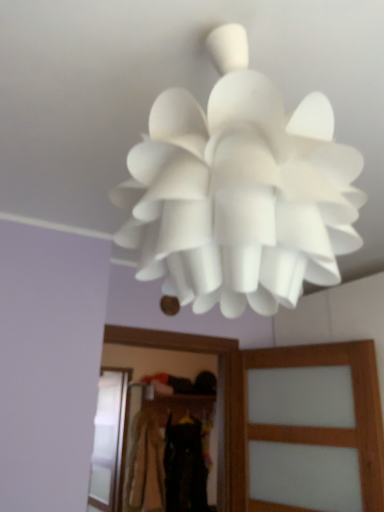
Question: Is translucent wood screen door at center, which ranks as the first screen door in right-to-left order, wider than dark brown fabric at center, the third clothing in the back-to-front sequence?

Choices:
 (A) no
 (B) yes

Answer: (A)

Question: From the image's perspective, is translucent wood screen door at center, which appears as the 2th screen door when viewed from the back, on top of dark brown fabric at center, the third clothing in the back-to-front sequence?

Choices:
 (A) no
 (B) yes

Answer: (B)

Question: Is translucent wood screen door at center, which ranks as the first screen door in right-to-left order, facing away from dark brown fabric at center, acting as the 1th clothing starting from the front?

Choices:
 (A) no
 (B) yes

Answer: (A)

Question: Does translucent wood screen door at center, positioned as the first screen door in front-to-back order, have a lesser width compared to dark brown fabric at center, the third clothing in the back-to-front sequence?

Choices:
 (A) yes
 (B) no

Answer: (A)

Question: Is translucent wood screen door at center, which appears as the 2th screen door when viewed from the back, not close to dark brown fabric at center, acting as the 1th clothing starting from the front?

Choices:
 (A) yes
 (B) no

Answer: (B)

Question: Is light brown fabric at center, arranged as the first clothing when viewed from the back, taller or shorter than dark brown fabric at center, acting as the 1th clothing starting from the front?

Choices:
 (A) tall
 (B) short

Answer: (B)

Question: Is light brown fabric at center, arranged as the first clothing when viewed from the back, in front of or behind dark brown fabric at center, acting as the 1th clothing starting from the front, in the image?

Choices:
 (A) behind
 (B) front

Answer: (A)

Question: Visually, is light brown fabric at center, arranged as the first clothing when viewed from the back, positioned to the left or to the right of dark brown fabric at center, acting as the 1th clothing starting from the front?

Choices:
 (A) right
 (B) left

Answer: (B)

Question: Looking at the image, does light brown fabric at center, arranged as the first clothing when viewed from the back, seem bigger or smaller compared to dark brown fabric at center, acting as the 1th clothing starting from the front?

Choices:
 (A) small
 (B) big

Answer: (A)

Question: Considering the positions of translucent wood screen door at center, which appears as the 2th screen door when viewed from the back, and transparent glass screen door at lower left, the first screen door positioned from the back, in the image, is translucent wood screen door at center, which appears as the 2th screen door when viewed from the back, wider or thinner than transparent glass screen door at lower left, the first screen door positioned from the back,?

Choices:
 (A) wide
 (B) thin

Answer: (A)

Question: Visually, is translucent wood screen door at center, which ranks as the first screen door in right-to-left order, positioned to the left or to the right of transparent glass screen door at lower left, which is the second screen door from front to back?

Choices:
 (A) left
 (B) right

Answer: (B)

Question: Considering the positions of translucent wood screen door at center, which is the 2th screen door in left-to-right order, and transparent glass screen door at lower left, the first screen door positioned from the back, in the image, is translucent wood screen door at center, which is the 2th screen door in left-to-right order, taller or shorter than transparent glass screen door at lower left, the first screen door positioned from the back,?

Choices:
 (A) short
 (B) tall

Answer: (A)

Question: From the image's perspective, is translucent wood screen door at center, positioned as the first screen door in front-to-back order, located above or below transparent glass screen door at lower left, acting as the second screen door starting from the right?

Choices:
 (A) below
 (B) above

Answer: (B)

Question: From the image's perspective, is translucent wood screen door at center, positioned as the first screen door in front-to-back order, located above or below black fabric at center, which appears as the second clothing when viewed from the back?

Choices:
 (A) above
 (B) below

Answer: (A)

Question: Is point coord(274,505) closer or farther from the camera than point coord(195,446)?

Choices:
 (A) closer
 (B) farther

Answer: (A)